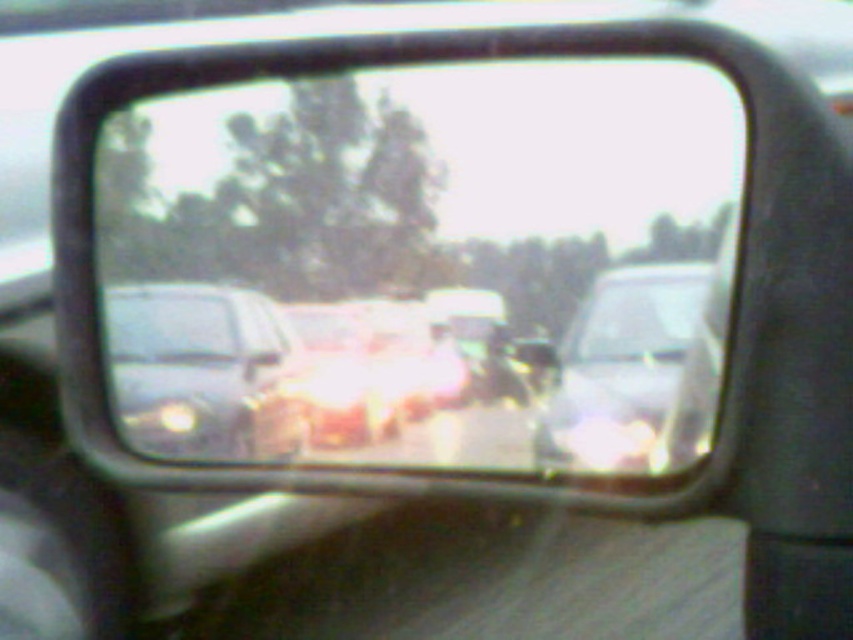
Question: Can you confirm if clear glass mirror at center is positioned below satin silver sedan at center?

Choices:
 (A) yes
 (B) no

Answer: (B)

Question: Can you confirm if clear glass mirror at center is thinner than satin silver sedan at center?

Choices:
 (A) yes
 (B) no

Answer: (B)

Question: Which object appears closest to the camera in this image?

Choices:
 (A) clear glass mirror at center
 (B) satin silver sedan at center

Answer: (A)

Question: Which object appears farthest from the camera in this image?

Choices:
 (A) satin silver sedan at left
 (B) clear glass mirror at center
 (C) satin silver sedan at center

Answer: (A)

Question: Which of the following is the closest to the observer?

Choices:
 (A) (364, 115)
 (B) (178, 360)

Answer: (A)

Question: Considering the relative positions of satin silver sedan at left and satin silver sedan at center in the image provided, where is satin silver sedan at left located with respect to satin silver sedan at center?

Choices:
 (A) right
 (B) left

Answer: (B)